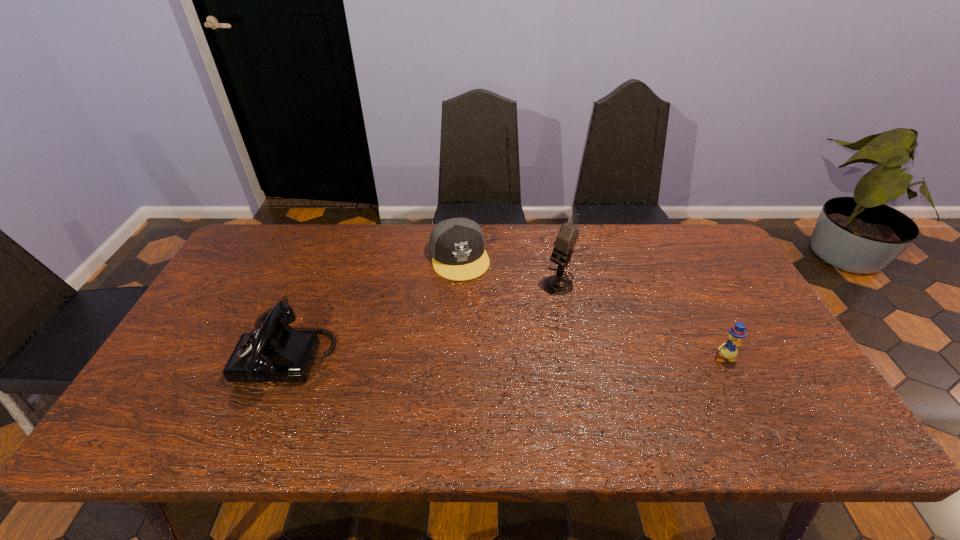
Image resolution: width=960 pixels, height=540 pixels. Identify the location of free spot on the desktop that is between the second tallest object and the duckling and is positioned on the front-facing side of the microphone. (468, 354).

You are a GUI agent. You are given a task and a screenshot of the screen. Output one action in this format:
    pyautogui.click(x=<x>, y=<y>)
    Task: Click on the vacant space on the desktop that is between the leftmost object and the duckling and is positioned on the front-facing side of the third object from right to left
    
    Given the screenshot: What is the action you would take?
    pyautogui.click(x=492, y=355)